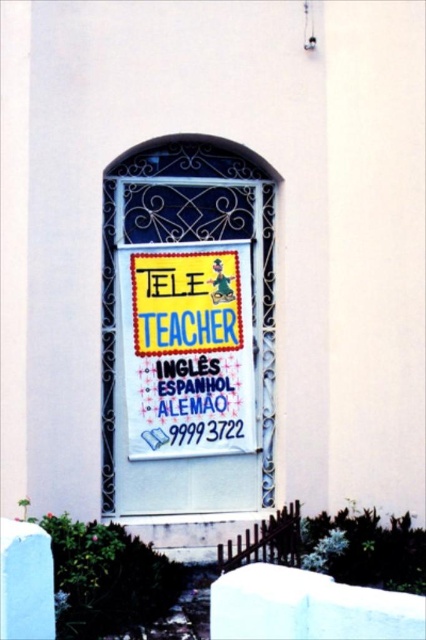
You are standing in front of the building and looking at the decorative arched window with the TELE TEACHER banner. There are two points marked on the window. Which point is closer to you, point 1 at coordinates (189, 269) or point 2 at coordinates (146, 364)?

Point 2 at coordinates (146, 364) is closer to you because it is less further to the camera than point 1 at coordinates (189, 269).

You are trying to hang two items on a wall. You have a white paper sign at center and a yellow fabric poster at center. Based on the scene, can you determine which item is wider?

The white paper sign at center might be wider than yellow fabric poster at center, so it is possible that the white paper sign at center is wider.